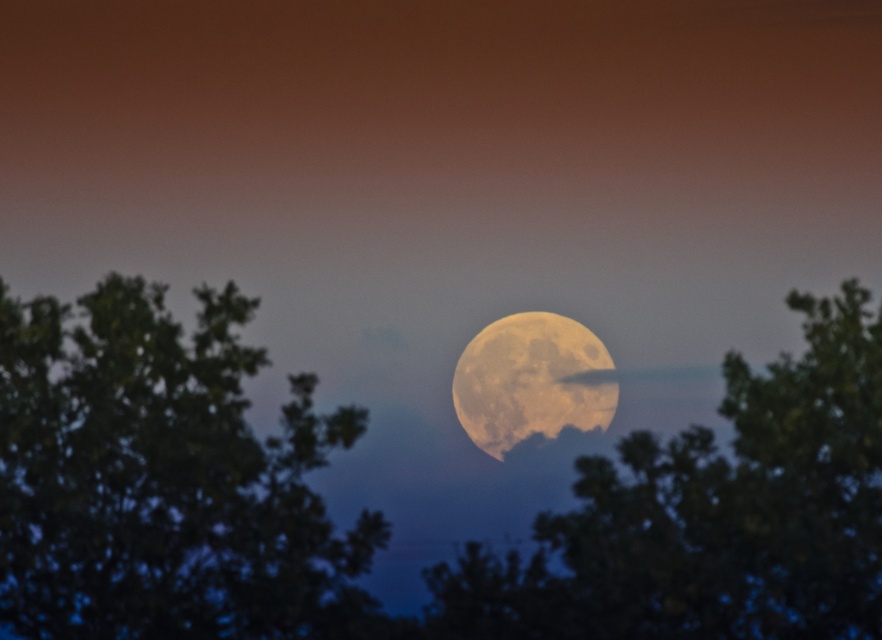
Between point (16, 608) and point (546, 381), which one is positioned in front?

Point (16, 608)

Does green leafy tree at left appear under golden textured moon at center?

Indeed, green leafy tree at left is positioned under golden textured moon at center.

Is point (34, 493) farther from camera compared to point (514, 406)?

That is False.

Find the location of a particular element. The width and height of the screenshot is (882, 640). green leafy tree at left is located at coordinates (162, 477).

Does green leafy tree at left have a greater width compared to green leafy tree at center?

No.

Does green leafy tree at left have a larger size compared to green leafy tree at center?

Incorrect, green leafy tree at left is not larger than green leafy tree at center.

Who is more distant from viewer, [243,428] or [862,502]?

Positioned behind is point [243,428].

I want to click on green leafy tree at left, so click(162, 477).

Does green leafy tree at center appear on the right side of golden textured moon at center?

Indeed, green leafy tree at center is positioned on the right side of golden textured moon at center.

Which is above, green leafy tree at center or golden textured moon at center?

Positioned higher is golden textured moon at center.

Image resolution: width=882 pixels, height=640 pixels. What do you see at coordinates (712, 515) in the screenshot?
I see `green leafy tree at center` at bounding box center [712, 515].

This screenshot has height=640, width=882. I want to click on green leafy tree at center, so click(x=712, y=515).